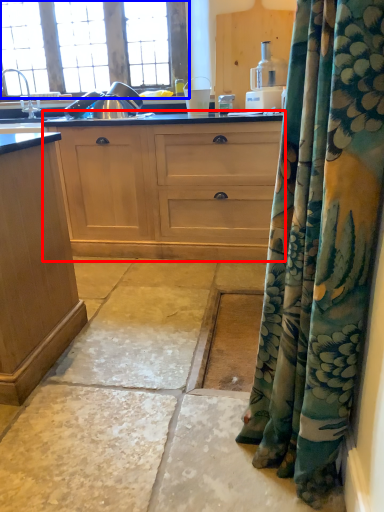
Question: Which point is closer to the camera, cabinetry (highlighted by a red box) or window (highlighted by a blue box)?

Choices:
 (A) cabinetry
 (B) window

Answer: (A)